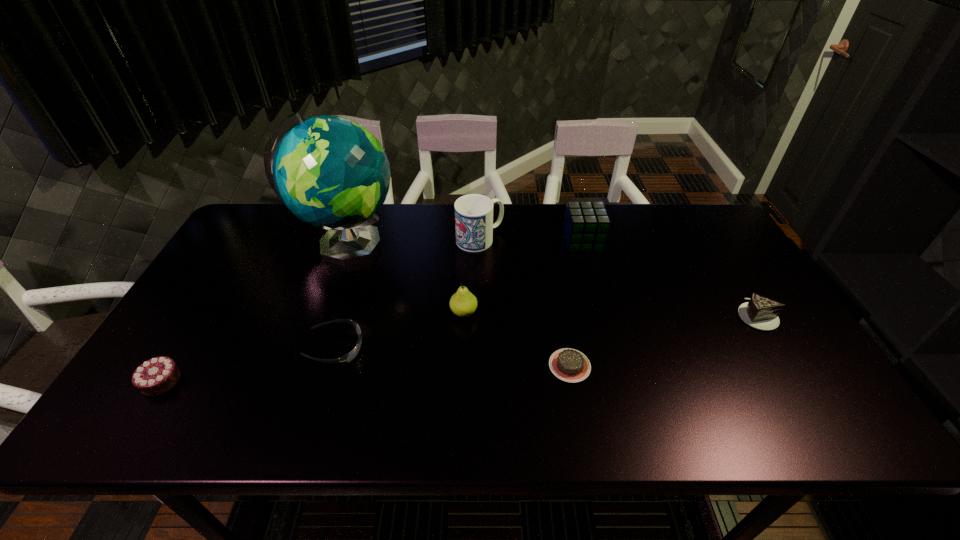
Where is `free spot between the leftmost object and the second shortest object`? free spot between the leftmost object and the second shortest object is located at coordinates pyautogui.click(x=249, y=364).

Where is `empty location between the tallest object and the pear`? empty location between the tallest object and the pear is located at coordinates (x=405, y=280).

Locate an element on the screen. empty space between the leftmost chocolate cake and the seventh object from left to right is located at coordinates (372, 311).

This screenshot has width=960, height=540. Find the location of `free spot between the cube and the mug`. free spot between the cube and the mug is located at coordinates (531, 240).

Locate an element on the screen. This screenshot has width=960, height=540. empty location between the leftmost object and the sunglasses is located at coordinates (249, 364).

Identify the location of object identified as the seventh closest to the pear. (760, 312).

Find the location of `object that stands as the sixth closest to the sunglasses`. object that stands as the sixth closest to the sunglasses is located at coordinates (586, 225).

At what (x,y) coordinates should I click in order to perform the action: click on chocolate cake that is the second closest to the leftmost chocolate cake. Please return your answer as a coordinate pair (x, y). This screenshot has height=540, width=960. Looking at the image, I should click on (760, 312).

The width and height of the screenshot is (960, 540). In order to click on chocolate cake that is the closest one to the pear in this screenshot , I will do `click(570, 365)`.

Where is `free space in the image that satisfies the following two spatial constraints: 1. on the back side of the shortest chocolate cake; 2. on the right side of the leftmost chocolate cake`? This screenshot has height=540, width=960. free space in the image that satisfies the following two spatial constraints: 1. on the back side of the shortest chocolate cake; 2. on the right side of the leftmost chocolate cake is located at coordinates (171, 366).